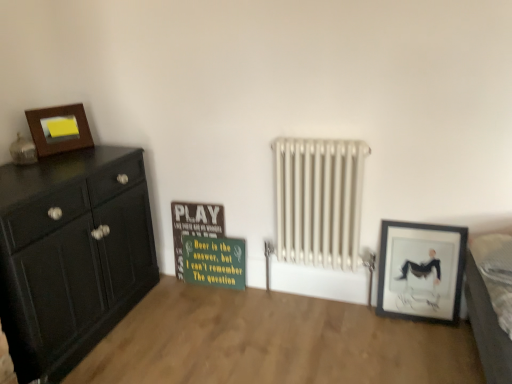
Question: Is matte black picture frame at lower right, which ranks as the first picture frame in right-to-left order, taller than matte wooden picture frame at upper left, placed as the first picture frame when sorted from top to bottom?

Choices:
 (A) no
 (B) yes

Answer: (B)

Question: Is matte black picture frame at lower right, which ranks as the 2th picture frame in left-to-right order, bigger than matte wooden picture frame at upper left, placed as the first picture frame when sorted from top to bottom?

Choices:
 (A) yes
 (B) no

Answer: (A)

Question: From the image's perspective, is matte black picture frame at lower right, which ranks as the first picture frame in right-to-left order, located above matte wooden picture frame at upper left, placed as the first picture frame when sorted from top to bottom?

Choices:
 (A) no
 (B) yes

Answer: (A)

Question: Can you confirm if matte black picture frame at lower right, which is counted as the 2th picture frame, starting from the top, is thinner than matte wooden picture frame at upper left, the 2th picture frame from the bottom?

Choices:
 (A) no
 (B) yes

Answer: (A)

Question: From the image's perspective, is matte black picture frame at lower right, the 1th picture frame when ordered from bottom to top, under matte wooden picture frame at upper left, which is the first picture frame in left-to-right order?

Choices:
 (A) no
 (B) yes

Answer: (B)

Question: From a real-world perspective, does matte black picture frame at lower right, the 1th picture frame when ordered from bottom to top, stand above matte wooden picture frame at upper left, placed as the second picture frame when sorted from right to left?

Choices:
 (A) no
 (B) yes

Answer: (A)

Question: Does white metallic radiator at center turn towards green matte signboard at center?

Choices:
 (A) no
 (B) yes

Answer: (A)

Question: From the image's perspective, does white metallic radiator at center appear higher than green matte signboard at center?

Choices:
 (A) no
 (B) yes

Answer: (B)

Question: Is white metallic radiator at center not close to green matte signboard at center?

Choices:
 (A) yes
 (B) no

Answer: (B)

Question: Is the position of white metallic radiator at center more distant than that of green matte signboard at center?

Choices:
 (A) no
 (B) yes

Answer: (A)

Question: Considering the relative sizes of white metallic radiator at center and green matte signboard at center in the image provided, is white metallic radiator at center wider than green matte signboard at center?

Choices:
 (A) no
 (B) yes

Answer: (B)

Question: Considering the relative positions of white metallic radiator at center and green matte signboard at center in the image provided, is white metallic radiator at center to the right of green matte signboard at center from the viewer's perspective?

Choices:
 (A) yes
 (B) no

Answer: (A)

Question: Does gray fabric bed at lower right have a smaller size compared to white metallic radiator at center?

Choices:
 (A) no
 (B) yes

Answer: (B)